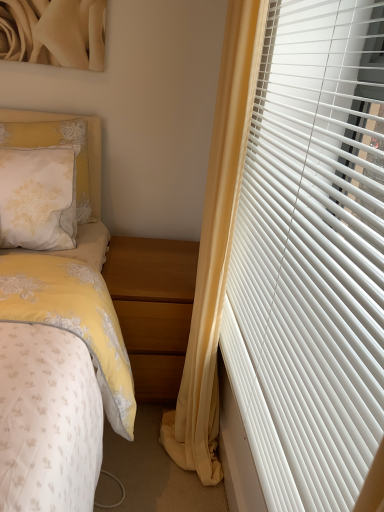
Describe the element at coordinates (216, 245) in the screenshot. I see `yellow fabric curtain at right` at that location.

Describe the element at coordinates (310, 262) in the screenshot. Image resolution: width=384 pixels, height=512 pixels. I see `white plastic blinds at right` at that location.

Where is `white lace pillow at upper left`? The image size is (384, 512). white lace pillow at upper left is located at coordinates (63, 144).

From the image's perspective, which one is positioned lower, yellow fabric curtain at right or white plastic blinds at right?

yellow fabric curtain at right.

Between yellow fabric curtain at right and white plastic blinds at right, which one has less height?

Standing shorter between the two is white plastic blinds at right.

Is yellow fabric curtain at right oriented away from white plastic blinds at right?

Yes, yellow fabric curtain at right is facing away from white plastic blinds at right.

Is white plastic blinds at right oriented towards white lace pillow at upper left?

No, white plastic blinds at right is not oriented towards white lace pillow at upper left.

Is white plastic blinds at right shorter than white lace pillow at upper left?

No, white plastic blinds at right is not shorter than white lace pillow at upper left.

Which object is wider, white plastic blinds at right or white lace pillow at upper left?

white lace pillow at upper left.

Is the position of white plastic blinds at right less distant than that of white lace pillow at upper left?

Yes.

Does white plastic blinds at right have a lesser height compared to yellow fabric curtain at right?

Correct, white plastic blinds at right is not as tall as yellow fabric curtain at right.

Considering the sizes of objects white plastic blinds at right and yellow fabric curtain at right in the image provided, who is wider, white plastic blinds at right or yellow fabric curtain at right?

yellow fabric curtain at right is wider.

From the picture: Can you confirm if white plastic blinds at right is positioned to the right of yellow fabric curtain at right?

Correct, you'll find white plastic blinds at right to the right of yellow fabric curtain at right.

Identify the location of window blind above the yellow fabric curtain at right (from the image's perspective). (310, 262).

Which of these two, white lace pillow at upper left or light brown wood at lower center, is bigger?

light brown wood at lower center.

Are white lace pillow at upper left and light brown wood at lower center located far from each other?

No, white lace pillow at upper left is not far away from light brown wood at lower center.

From the image's perspective, would you say white lace pillow at upper left is positioned over light brown wood at lower center?

Yes, from the image's perspective, white lace pillow at upper left is over light brown wood at lower center.

How different are the orientations of white lace pillow at upper left and light brown wood at lower center in degrees?

The facing directions of white lace pillow at upper left and light brown wood at lower center are 3.03 degrees apart.

From the image's perspective, which object appears higher, yellow fabric curtain at right or light brown wood at lower center?

From the image's view, yellow fabric curtain at right is above.

What's the angular difference between yellow fabric curtain at right and light brown wood at lower center's facing directions?

There is a 90-degree angle between the facing directions of yellow fabric curtain at right and light brown wood at lower center.

Considering the sizes of objects yellow fabric curtain at right and light brown wood at lower center in the image provided, who is taller, yellow fabric curtain at right or light brown wood at lower center?

Standing taller between the two is yellow fabric curtain at right.

Is yellow fabric curtain at right facing towards light brown wood at lower center?

No, yellow fabric curtain at right is not turned towards light brown wood at lower center.

Which of these two, light brown wood at lower center or white lace pillow at upper left, stands shorter?

white lace pillow at upper left.

From the image's perspective, which is above, light brown wood at lower center or white lace pillow at upper left?

white lace pillow at upper left.

Which object is wider, light brown wood at lower center or white lace pillow at upper left?

light brown wood at lower center.

At what (x,y) coordinates should I click in order to perform the action: click on nightstand below the yellow fabric curtain at right (from the image's perspective). Please return your answer as a coordinate pair (x, y). Looking at the image, I should click on (153, 308).

Is light brown wood at lower center behind yellow fabric curtain at right?

Yes, it is.

From the picture: Which point is more distant from viewer, [134,310] or [238,177]?

The point [134,310] is more distant.

Which of these two, light brown wood at lower center or yellow fabric curtain at right, stands taller?

With more height is yellow fabric curtain at right.

In order to click on window blind that appears in front of the yellow fabric curtain at right in this screenshot , I will do `click(310, 262)`.

The height and width of the screenshot is (512, 384). Find the location of `pillow that is above the white plastic blinds at right (from the image's perspective)`. pillow that is above the white plastic blinds at right (from the image's perspective) is located at coordinates (63, 144).

Considering their positions, is yellow fabric curtain at right positioned closer to white lace pillow at upper left than light brown wood at lower center?

Among the two, light brown wood at lower center is located nearer to white lace pillow at upper left.

Which object lies further to the anchor point white lace pillow at upper left, white plastic blinds at right or yellow fabric curtain at right?

white plastic blinds at right.

Considering their positions, is light brown wood at lower center positioned closer to yellow fabric curtain at right than white plastic blinds at right?

Among the two, white plastic blinds at right is located nearer to yellow fabric curtain at right.

Based on their spatial positions, is white lace pillow at upper left or yellow fabric curtain at right closer to white plastic blinds at right?

Among the two, yellow fabric curtain at right is located nearer to white plastic blinds at right.

Based on their spatial positions, is white plastic blinds at right or light brown wood at lower center further from yellow fabric curtain at right?

light brown wood at lower center is further to yellow fabric curtain at right.

Looking at the image, which one is located closer to light brown wood at lower center, white plastic blinds at right or white lace pillow at upper left?

white lace pillow at upper left is closer to light brown wood at lower center.

Which object lies further to the anchor point light brown wood at lower center, white lace pillow at upper left or yellow fabric curtain at right?

white lace pillow at upper left is positioned further to the anchor light brown wood at lower center.

Looking at the image, which one is located further to white plastic blinds at right, yellow fabric curtain at right or white lace pillow at upper left?

white lace pillow at upper left.

This screenshot has width=384, height=512. In order to click on nightstand positioned between white plastic blinds at right and white lace pillow at upper left from near to far in this screenshot , I will do `click(153, 308)`.

Where is `nightstand between yellow fabric curtain at right and white lace pillow at upper left along the z-axis`? nightstand between yellow fabric curtain at right and white lace pillow at upper left along the z-axis is located at coordinates (153, 308).

Locate an element on the screen. This screenshot has width=384, height=512. curtain between white plastic blinds at right and light brown wood at lower center from front to back is located at coordinates (216, 245).

The image size is (384, 512). I want to click on curtain between white plastic blinds at right and white lace pillow at upper left in the front-back direction, so click(216, 245).